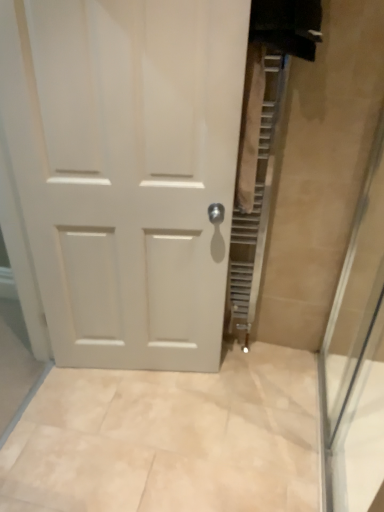
Locate an element on the screen. vacant area that lies between white matte door at center and transparent glass shower door at right is located at coordinates (231, 425).